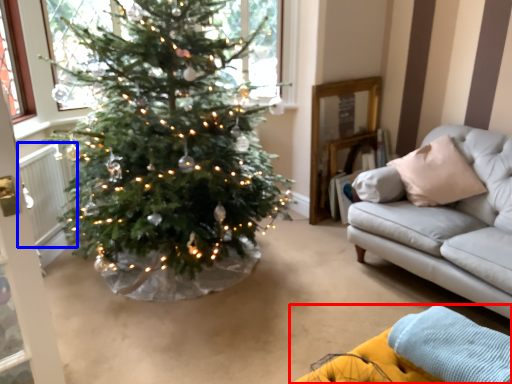
Question: Which of the following is the closest to the observer, couch (highlighted by a red box) or radiator (highlighted by a blue box)?

Choices:
 (A) couch
 (B) radiator

Answer: (A)